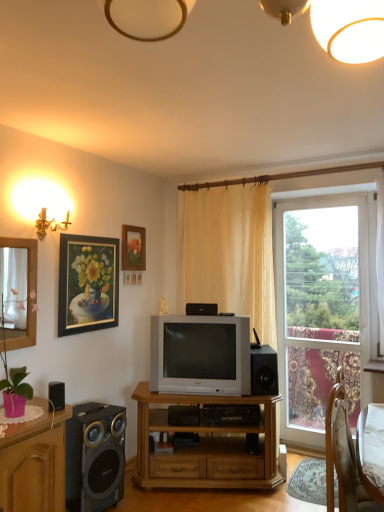
I want to click on vacant area on the back side of black plastic speaker at center, the fourth speaker from the bottom, so click(x=203, y=312).